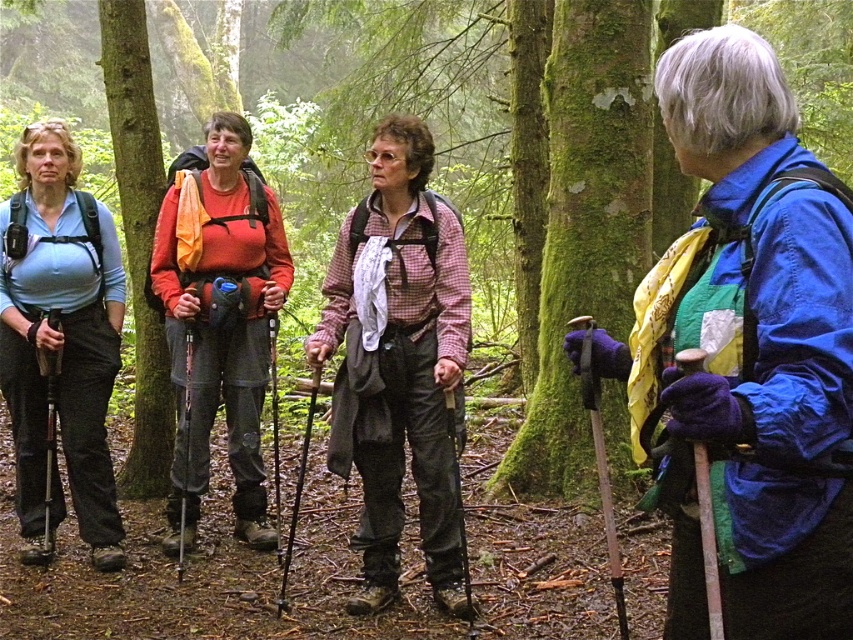
Question: Which of the following is the farthest from the observer?

Choices:
 (A) (120, 36)
 (B) (25, 308)

Answer: (A)

Question: Considering the real-world distances, which object is farthest from the blue fabric jacket at right?

Choices:
 (A) matte blue shirt at left
 (B) green mossy tree at left
 (C) matte orange shirt at center

Answer: (B)

Question: Which of the following is the closest to the observer?

Choices:
 (A) (694, 61)
 (B) (141, 168)
 (C) (103, 339)
 (D) (178, 180)

Answer: (A)

Question: Is matte blue shirt at left bigger than matte orange shirt at center?

Choices:
 (A) yes
 (B) no

Answer: (B)

Question: Is blue fabric jacket at right thinner than matte blue shirt at left?

Choices:
 (A) yes
 (B) no

Answer: (A)

Question: Can you confirm if matte blue shirt at left is positioned below matte orange shirt at center?

Choices:
 (A) no
 (B) yes

Answer: (B)